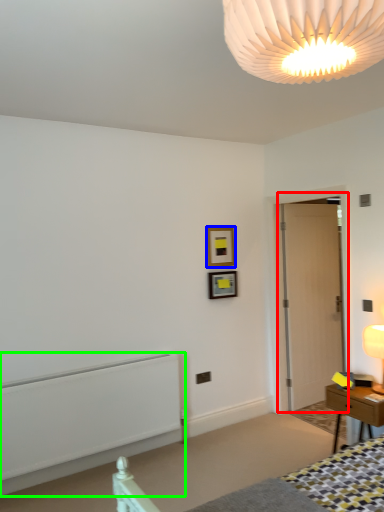
Question: Estimate the real-world distances between objects in this image. Which object is closer to door (highlighted by a red box), picture frame (highlighted by a blue box) or radiator (highlighted by a green box)?

Choices:
 (A) picture frame
 (B) radiator

Answer: (A)